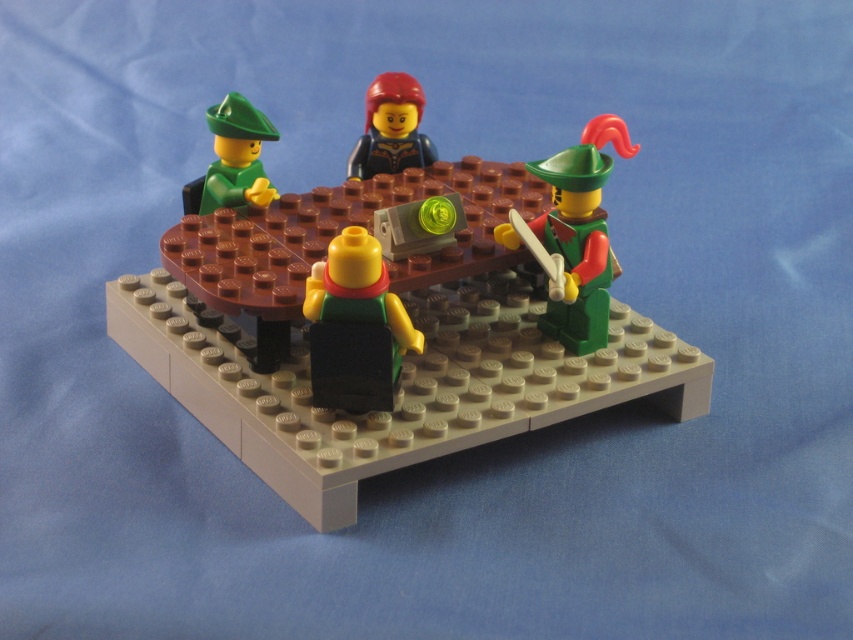
Is the position of brown matte table at center less distant than that of green matte minifigure at right?

Yes, it is in front of green matte minifigure at right.

Between point (347, 186) and point (576, 321), which one is positioned behind?

Positioned behind is point (347, 186).

Is point (622, 376) in front of point (595, 348)?

Yes.

Where is `brown matte table at center`? Image resolution: width=853 pixels, height=640 pixels. brown matte table at center is located at coordinates (390, 326).

Which is behind, point (386, 307) or point (227, 173)?

The point (227, 173) is behind.

Can you confirm if matte green minifigure at center is positioned to the right of matte green minifigure at left?

Yes, matte green minifigure at center is to the right of matte green minifigure at left.

Is point (366, 257) more distant than point (235, 115)?

That is False.

I want to click on matte green minifigure at center, so click(x=355, y=326).

The width and height of the screenshot is (853, 640). Describe the element at coordinates (236, 156) in the screenshot. I see `matte green minifigure at left` at that location.

Can you confirm if matte green minifigure at left is smaller than smooth black minifigure at center?

Indeed, matte green minifigure at left has a smaller size compared to smooth black minifigure at center.

Between point (244, 116) and point (370, 124), which one is positioned behind?

Positioned behind is point (370, 124).

This screenshot has width=853, height=640. In order to click on matte green minifigure at left in this screenshot , I will do `click(236, 156)`.